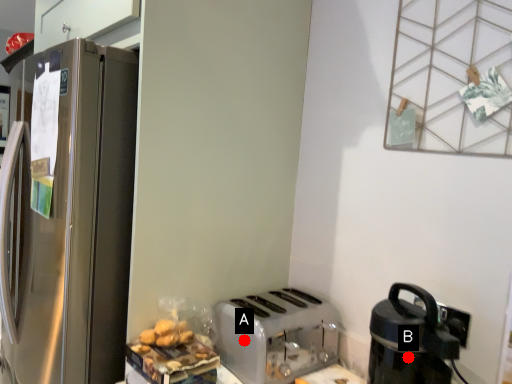
Question: Two points are circled on the image, labeled by A and B beside each circle. Among these points, which one is farthest from the camera?

Choices:
 (A) A is further
 (B) B is further

Answer: (A)